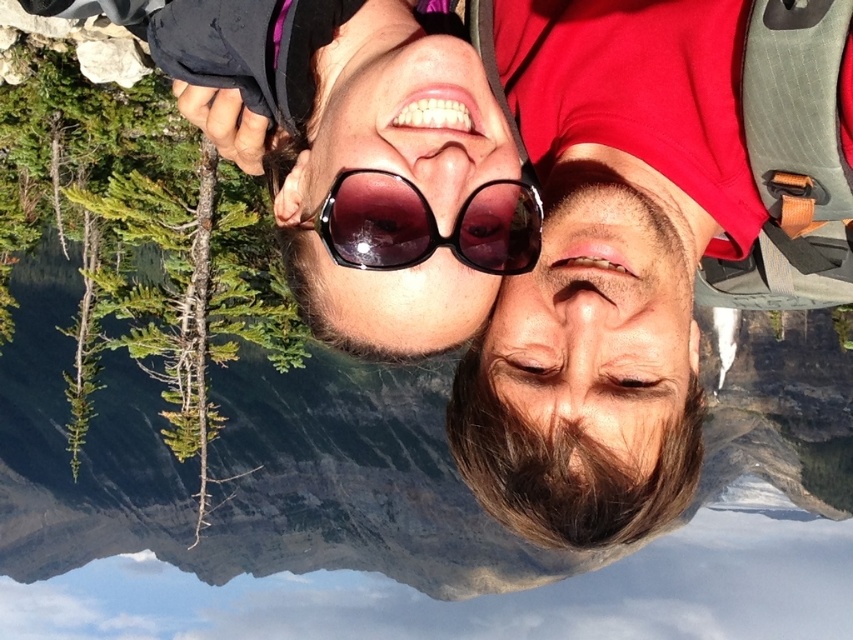
Question: Is matte red shirt at right further to the viewer compared to transparent plastic goggles at center?

Choices:
 (A) no
 (B) yes

Answer: (A)

Question: In this image, where is matte red shirt at right located relative to transparent plastic goggles at center?

Choices:
 (A) left
 (B) right

Answer: (B)

Question: Which point is farther to the camera?

Choices:
 (A) transparent plastic goggles at center
 (B) matte red shirt at right

Answer: (A)

Question: Is matte red shirt at right wider than transparent plastic goggles at center?

Choices:
 (A) yes
 (B) no

Answer: (A)